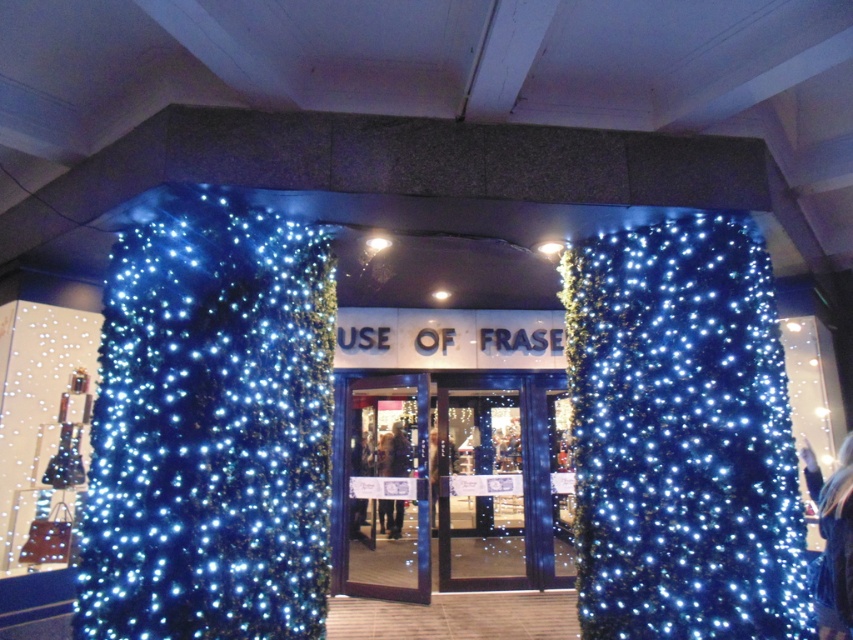
Question: Among these objects, which one is farthest from the camera?

Choices:
 (A) blue glass doors at center
 (B) blue led lights at left

Answer: (A)

Question: Based on their relative distances, which object is nearer to the shiny dark blue door at center?

Choices:
 (A) illuminated blue lights at center
 (B) blue led lights at left

Answer: (A)

Question: Can you confirm if illuminated blue lights at center is positioned to the right of blue glass doors at center?

Choices:
 (A) no
 (B) yes

Answer: (B)

Question: Does blue led lights at left come in front of transparent glass door at center?

Choices:
 (A) no
 (B) yes

Answer: (B)

Question: Can you confirm if illuminated blue lights at center is positioned to the right of transparent glass door at center?

Choices:
 (A) yes
 (B) no

Answer: (A)

Question: Estimate the real-world distances between objects in this image. Which object is closer to the blue glass doors at center?

Choices:
 (A) shiny dark blue door at center
 (B) blue led lights at left
 (C) transparent glass door at center

Answer: (A)